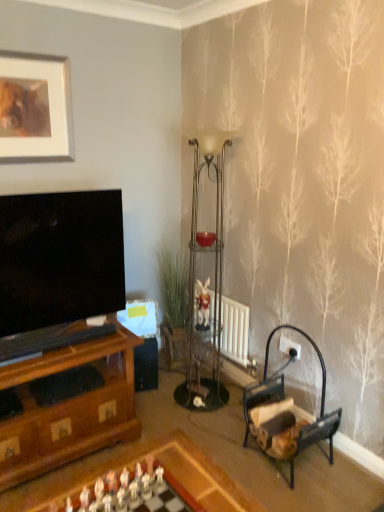
Find the location of a particular element. This screenshot has height=512, width=384. free space to the left of metallic glass shelf at center is located at coordinates (160, 393).